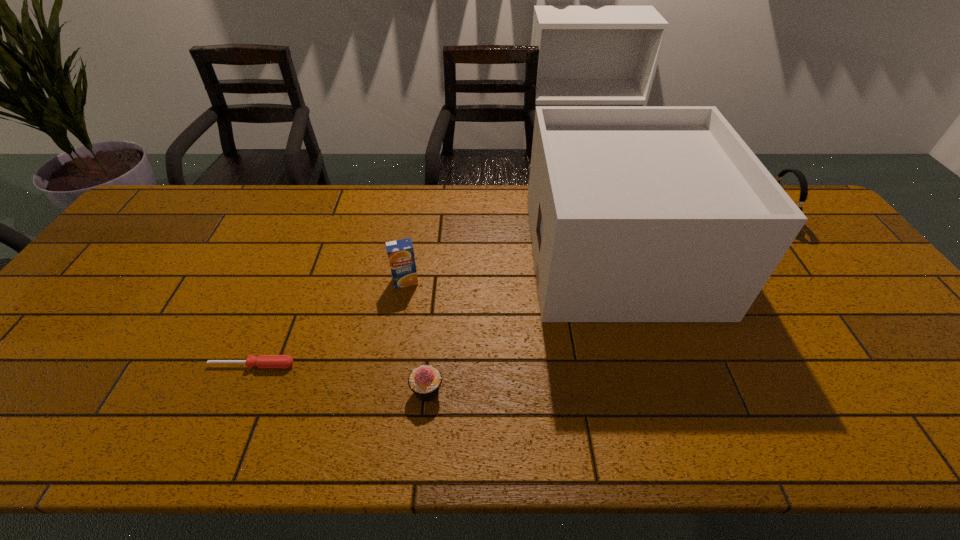
I want to click on the tallest object, so click(637, 213).

The height and width of the screenshot is (540, 960). Find the location of `the second object from right to left`. the second object from right to left is located at coordinates (637, 213).

The width and height of the screenshot is (960, 540). Find the location of `the rightmost object`. the rightmost object is located at coordinates (802, 179).

This screenshot has width=960, height=540. I want to click on headset, so click(802, 179).

You are a GUI agent. You are given a task and a screenshot of the screen. Output one action in this format:
    pyautogui.click(x=<x>, y=<y>)
    Task: Click on the fourth object from right to left
    The width and height of the screenshot is (960, 540).
    Given the screenshot: What is the action you would take?
    (401, 257)

This screenshot has height=540, width=960. In order to click on orange_juice in this screenshot , I will do `click(401, 257)`.

Where is `cupcake`? The width and height of the screenshot is (960, 540). cupcake is located at coordinates point(425,381).

This screenshot has height=540, width=960. In order to click on the second shortest object in this screenshot , I will do `click(425, 381)`.

Where is `the shortest object`? the shortest object is located at coordinates (262, 361).

Locate an element on the screen. The image size is (960, 540). the leftmost object is located at coordinates (262, 361).